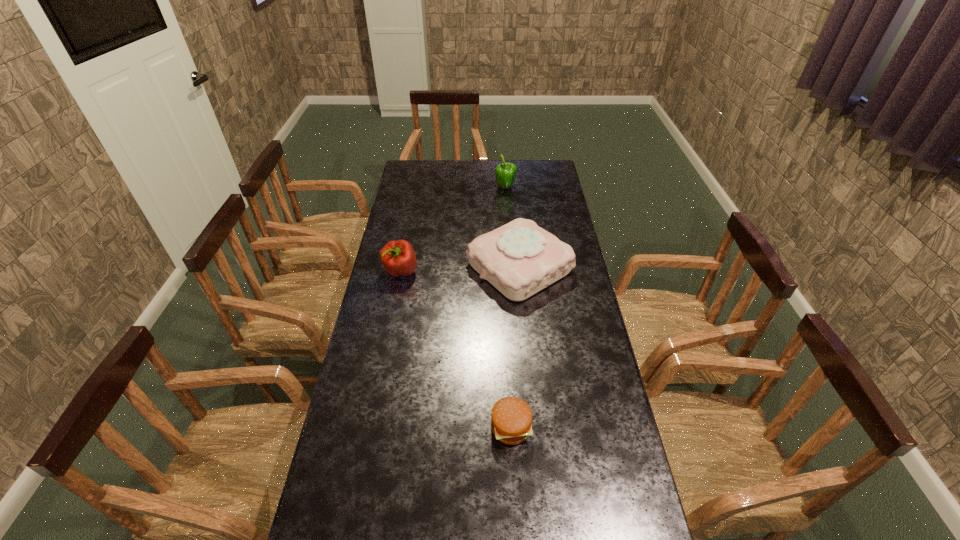
Identify the location of free space located on the left of the nearest object. This screenshot has height=540, width=960. (454, 428).

Find the location of `object that is at the far edge`. object that is at the far edge is located at coordinates (505, 172).

Where is `object that is at the left edge`? The height and width of the screenshot is (540, 960). object that is at the left edge is located at coordinates (398, 257).

This screenshot has height=540, width=960. I want to click on object that is positioned at the right edge, so click(519, 259).

This screenshot has height=540, width=960. Identify the location of vacant position at the far edge of the desktop. (450, 166).

Find the location of a particular element. free space at the left edge of the desktop is located at coordinates (396, 193).

The image size is (960, 540). Find the location of `vacant point at the right edge`. vacant point at the right edge is located at coordinates (584, 293).

Where is `vacant area that lies between the cake and the leftmost object`? vacant area that lies between the cake and the leftmost object is located at coordinates (460, 269).

Find the location of a particular element. free point between the left bell pepper and the cake is located at coordinates (460, 269).

You are a GUI agent. You are given a task and a screenshot of the screen. Output one action in this format:
    pyautogui.click(x=<x>, y=<y>)
    Task: Click on the vacant area between the nearest object and the shorter bell pepper
    The width and height of the screenshot is (960, 540).
    Given the screenshot: What is the action you would take?
    pyautogui.click(x=456, y=349)